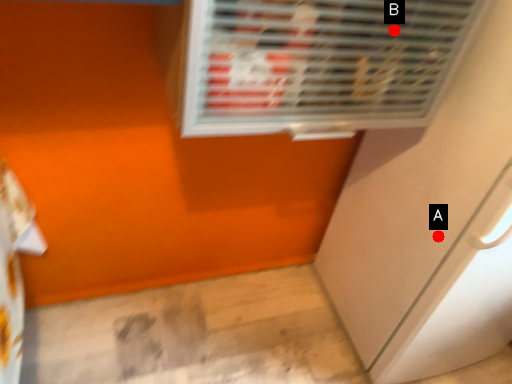
Question: Two points are circled on the image, labeled by A and B beside each circle. Which of the following is the closest to the observer?

Choices:
 (A) A is closer
 (B) B is closer

Answer: (B)